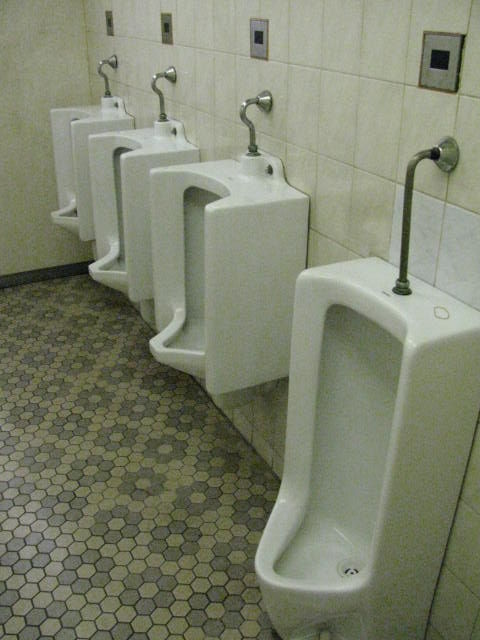
Find the location of a particular element. pipes going into wall above urinal is located at coordinates (449, 160), (269, 106), (176, 79), (111, 63).